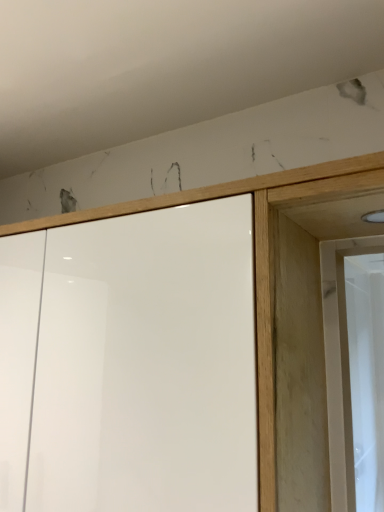
Question: Does white glossy cupboard at center have a smaller size compared to white glossy screen door at right?

Choices:
 (A) yes
 (B) no

Answer: (B)

Question: Does white glossy cupboard at center come behind white glossy screen door at right?

Choices:
 (A) no
 (B) yes

Answer: (A)

Question: Could you tell me if white glossy cupboard at center is facing white glossy screen door at right?

Choices:
 (A) yes
 (B) no

Answer: (B)

Question: Is white glossy cupboard at center positioned beyond the bounds of white glossy screen door at right?

Choices:
 (A) no
 (B) yes

Answer: (B)

Question: Is the position of white glossy cupboard at center less distant than that of white glossy screen door at right?

Choices:
 (A) no
 (B) yes

Answer: (B)

Question: Does white glossy cupboard at center appear on the right side of white glossy screen door at right?

Choices:
 (A) yes
 (B) no

Answer: (B)

Question: From a real-world perspective, does white glossy screen door at right sit lower than white glossy cupboard at center?

Choices:
 (A) no
 (B) yes

Answer: (A)

Question: Can you confirm if white glossy screen door at right is positioned to the right of white glossy cupboard at center?

Choices:
 (A) no
 (B) yes

Answer: (B)

Question: From a real-world perspective, is white glossy screen door at right positioned over white glossy cupboard at center based on gravity?

Choices:
 (A) yes
 (B) no

Answer: (A)

Question: Considering the relative sizes of white glossy screen door at right and white glossy cupboard at center in the image provided, is white glossy screen door at right bigger than white glossy cupboard at center?

Choices:
 (A) no
 (B) yes

Answer: (A)

Question: Does white glossy screen door at right have a lesser width compared to white glossy cupboard at center?

Choices:
 (A) yes
 (B) no

Answer: (A)

Question: Could you tell me if white glossy screen door at right is turned towards white glossy cupboard at center?

Choices:
 (A) yes
 (B) no

Answer: (B)

Question: Would you say white glossy cupboard at center is to the left or to the right of white glossy screen door at right in the picture?

Choices:
 (A) right
 (B) left

Answer: (B)